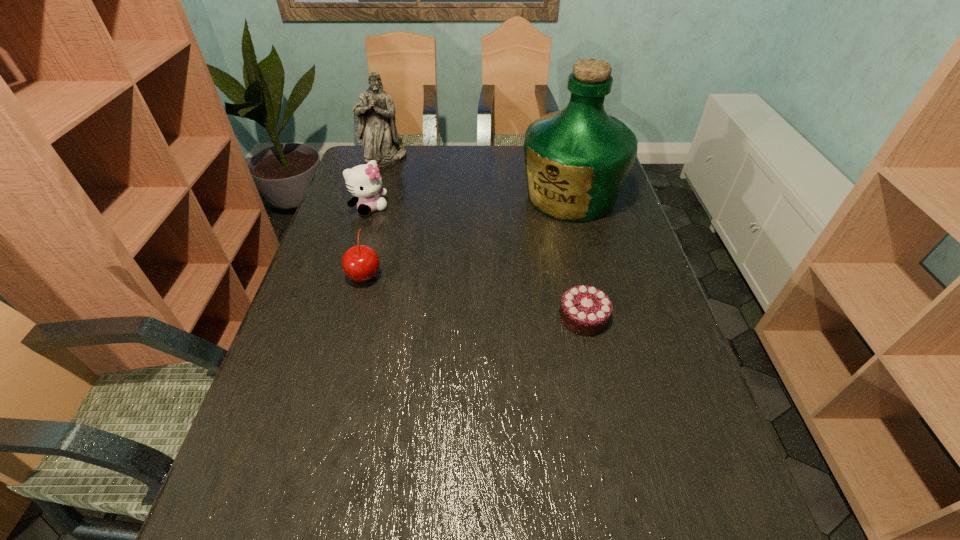
Where is `vacant space on the desktop that is between the cherry and the nearest object and is positioned on the front-facing side of the farthest object`? The image size is (960, 540). vacant space on the desktop that is between the cherry and the nearest object and is positioned on the front-facing side of the farthest object is located at coordinates (474, 296).

Where is `free space on the desktop that is between the second shortest object and the chocolate cake and is positioned on the label side of the tallest object`? Image resolution: width=960 pixels, height=540 pixels. free space on the desktop that is between the second shortest object and the chocolate cake and is positioned on the label side of the tallest object is located at coordinates (456, 293).

Locate an element on the screen. This screenshot has height=540, width=960. vacant space on the desktop that is between the fourth tallest object and the chocolate cake and is positioned on the front-facing side of the third tallest object is located at coordinates (448, 291).